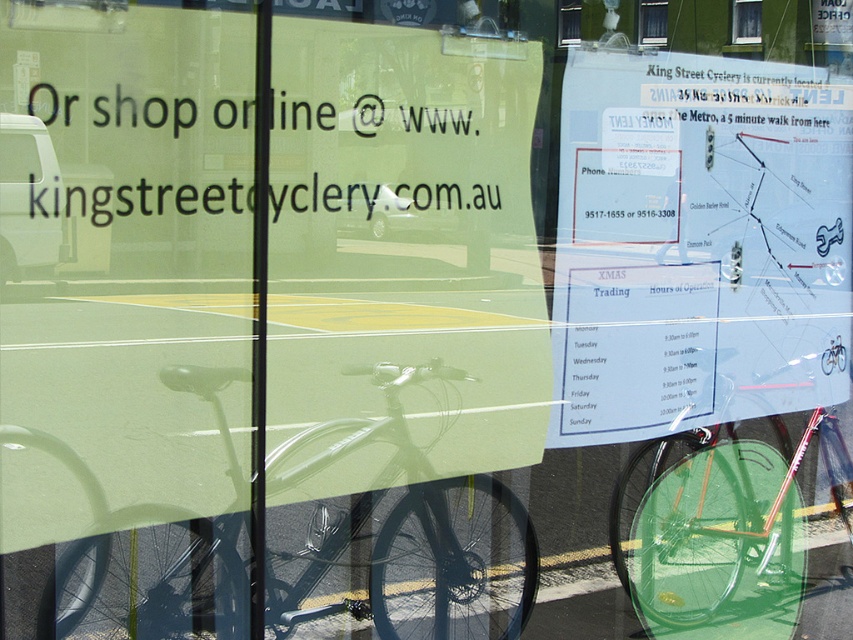
Describe the element at coordinates (698, 243) in the screenshot. I see `white paper map at upper center` at that location.

Is point (582, 253) more distant than point (564, 44)?

Yes, point (582, 253) is behind point (564, 44).

Identify the location of white paper map at upper center. (698, 243).

Between green glass window at upper center and clear glass window at upper center, which one appears on the right side from the viewer's perspective?

From the viewer's perspective, green glass window at upper center appears more on the right side.

Is green glass window at upper center in front of clear glass window at upper center?

That is False.

The height and width of the screenshot is (640, 853). In order to click on green glass window at upper center in this screenshot , I will do `click(746, 20)`.

Image resolution: width=853 pixels, height=640 pixels. What are the coordinates of `green glass window at upper center` in the screenshot? It's located at (746, 20).

Who is positioned more to the left, green matte bicycle at center or green glass window at upper center?

Positioned to the left is green glass window at upper center.

Is green matte bicycle at center to the right of green glass window at upper center from the viewer's perspective?

Indeed, green matte bicycle at center is positioned on the right side of green glass window at upper center.

The height and width of the screenshot is (640, 853). What do you see at coordinates (735, 525) in the screenshot?
I see `green matte bicycle at center` at bounding box center [735, 525].

This screenshot has width=853, height=640. Find the location of `green matte bicycle at center`. green matte bicycle at center is located at coordinates (735, 525).